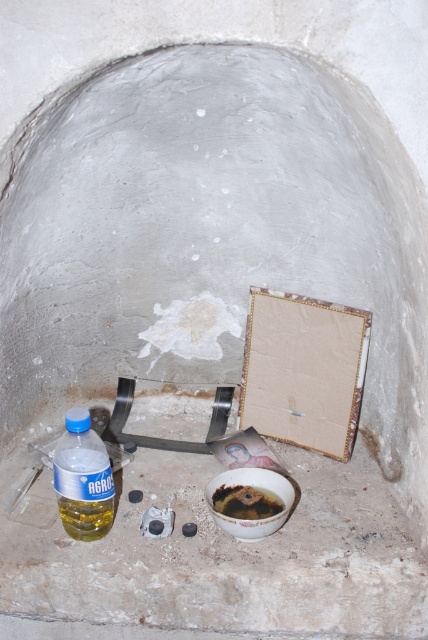
You are organizing items in the niche and need to place the translucent yellow plastic bottle at lower left and the brown matte bowl at center. If you want to move the bottle to the right side of the bowl, will that be possible based on their current positions?

The translucent yellow plastic bottle at lower left is currently on the left side of the brown matte bowl at center, so moving it to the right side of the bowl would require shifting its position to the opposite side.